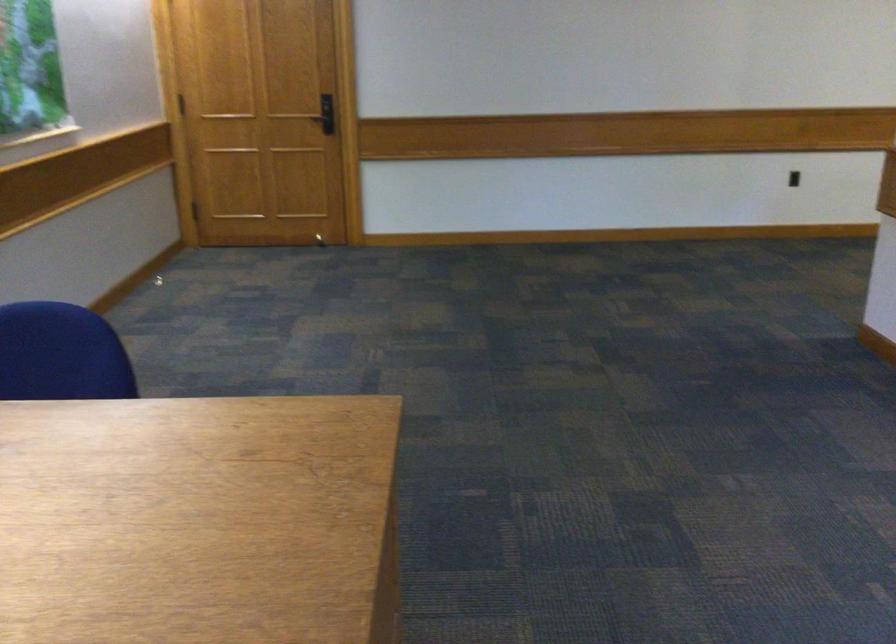
Based on the continuous images, in which direction is the camera rotating?

The rotation direction of the camera is right-down.